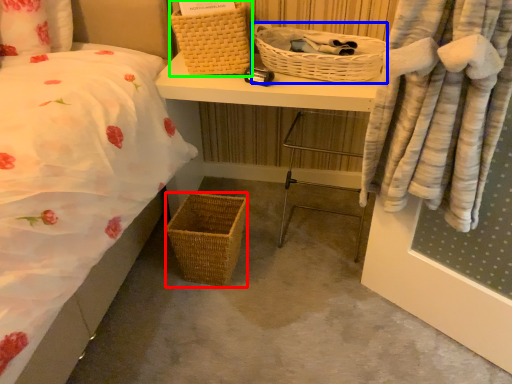
Question: Based on their relative distances, which object is farther from picnic basket (highlighted by a red box)? Choose from picnic basket (highlighted by a blue box) and picnic basket (highlighted by a green box).

Choices:
 (A) picnic basket
 (B) picnic basket

Answer: (A)